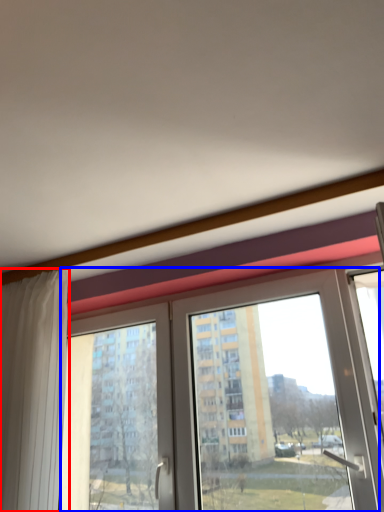
Question: Which object is further to the camera taking this photo, curtain (highlighted by a red box) or window (highlighted by a blue box)?

Choices:
 (A) curtain
 (B) window

Answer: (A)